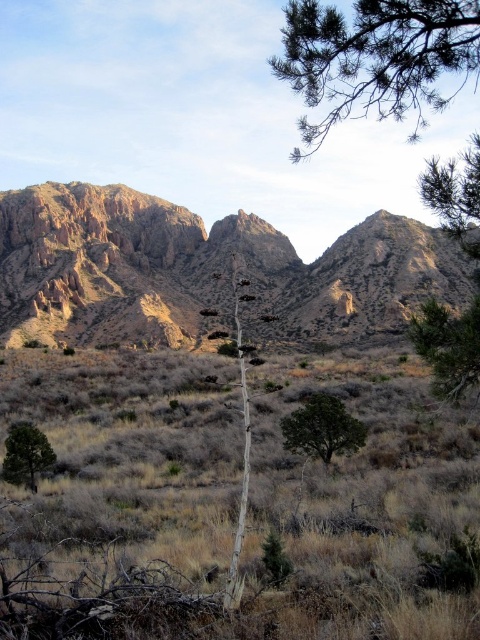
The image size is (480, 640). What do you see at coordinates (235, 506) in the screenshot?
I see `dry grass at center` at bounding box center [235, 506].

Does dry grass at center lie behind green leafy tree at center?

No, it is not.

Is point (48, 529) positioned after point (352, 429)?

No.

This screenshot has height=640, width=480. I want to click on dry grass at center, so click(235, 506).

In order to click on dry grass at center in this screenshot , I will do `click(235, 506)`.

Is dry grass at center smaller than green needle-like branches at upper right?

Indeed, dry grass at center has a smaller size compared to green needle-like branches at upper right.

Does point (136, 406) lie behind point (363, 42)?

Yes, point (136, 406) is farther from viewer.

At what (x,y) coordinates should I click in order to perform the action: click on dry grass at center. Please return your answer as a coordinate pair (x, y). Looking at the image, I should click on (235, 506).

Between dry grass at center and white bark tree at center, which one appears on the left side from the viewer's perspective?

white bark tree at center

Between point (215, 477) and point (244, 445), which one is positioned in front?

Positioned in front is point (215, 477).

Locate an element on the screen. The image size is (480, 640). dry grass at center is located at coordinates (235, 506).